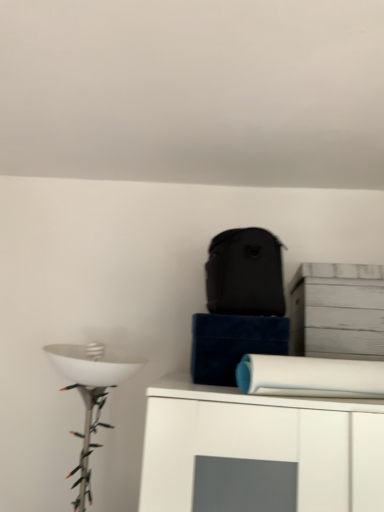
Where is `white wood cabinet at upper right`? Image resolution: width=384 pixels, height=512 pixels. white wood cabinet at upper right is located at coordinates (337, 311).

What do you see at coordinates (337, 311) in the screenshot? I see `white wood cabinet at upper right` at bounding box center [337, 311].

The width and height of the screenshot is (384, 512). What do you see at coordinates (310, 377) in the screenshot? I see `white matte toilet paper at upper right` at bounding box center [310, 377].

The width and height of the screenshot is (384, 512). In order to click on white matte toilet paper at upper right in this screenshot , I will do `click(310, 377)`.

The width and height of the screenshot is (384, 512). I want to click on white wood cabinet at upper right, so click(337, 311).

Is white wood cabinet at upper right to the left or to the right of white matte toilet paper at upper right in the image?

Based on their positions, white wood cabinet at upper right is located to the right of white matte toilet paper at upper right.

Based on the photo, does white wood cabinet at upper right lie in front of white matte toilet paper at upper right?

No, white wood cabinet at upper right is behind white matte toilet paper at upper right.

Is point (351, 279) in front of point (307, 369)?

No.

From the image's perspective, would you say white wood cabinet at upper right is shown under white matte toilet paper at upper right?

Incorrect, from the image's perspective, white wood cabinet at upper right is higher than white matte toilet paper at upper right.

From a real-world perspective, which is physically below, white wood cabinet at upper right or white matte toilet paper at upper right?

In real-world perspective, white matte toilet paper at upper right is lower.

Which of these two, white wood cabinet at upper right or white matte toilet paper at upper right, is wider?

Wider between the two is white matte toilet paper at upper right.

Between white wood cabinet at upper right and white matte toilet paper at upper right, which one has less height?

white matte toilet paper at upper right.

Can you confirm if white wood cabinet at upper right is bigger than white matte toilet paper at upper right?

No, white wood cabinet at upper right is not bigger than white matte toilet paper at upper right.

Would you say white wood cabinet at upper right is inside or outside white matte toilet paper at upper right?

white wood cabinet at upper right is outside white matte toilet paper at upper right.

Would you say white wood cabinet at upper right is a long distance from white matte toilet paper at upper right?

No, white wood cabinet at upper right is in close proximity to white matte toilet paper at upper right.

Is white wood cabinet at upper right facing away from white matte toilet paper at upper right?

white wood cabinet at upper right does not have its back to white matte toilet paper at upper right.

How different are the orientations of white wood cabinet at upper right and white matte toilet paper at upper right in degrees?

The facing directions of white wood cabinet at upper right and white matte toilet paper at upper right are 26.9 degrees apart.

You are a GUI agent. You are given a task and a screenshot of the screen. Output one action in this format:
    pyautogui.click(x=<x>, y=<y>)
    Task: Click on the cabinetry behind the white matte toilet paper at upper right
    The height and width of the screenshot is (512, 384).
    Given the screenshot: What is the action you would take?
    pyautogui.click(x=337, y=311)

Which is more to the left, white matte toilet paper at upper right or white wood cabinet at upper right?

Positioned to the left is white matte toilet paper at upper right.

Is white matte toilet paper at upper right closer to the viewer compared to white wood cabinet at upper right?

Yes.

Does point (365, 368) appear closer or farther from the camera than point (383, 319)?

Point (365, 368).

From the image's perspective, is white matte toilet paper at upper right located above or below white wood cabinet at upper right?

Clearly, from the image's perspective, white matte toilet paper at upper right is below white wood cabinet at upper right.

From a real-world perspective, is white matte toilet paper at upper right located beneath white wood cabinet at upper right?

Yes, from a real-world perspective, white matte toilet paper at upper right is below white wood cabinet at upper right.

Looking at their sizes, would you say white matte toilet paper at upper right is wider or thinner than white wood cabinet at upper right?

In the image, white matte toilet paper at upper right appears to be wider than white wood cabinet at upper right.

Does white matte toilet paper at upper right have a greater height compared to white wood cabinet at upper right?

In fact, white matte toilet paper at upper right may be shorter than white wood cabinet at upper right.

Based on their sizes in the image, would you say white matte toilet paper at upper right is bigger or smaller than white wood cabinet at upper right?

Clearly, white matte toilet paper at upper right is larger in size than white wood cabinet at upper right.

Is white wood cabinet at upper right inside white matte toilet paper at upper right?

No, white wood cabinet at upper right is not surrounded by white matte toilet paper at upper right.

Would you consider white matte toilet paper at upper right to be distant from white wood cabinet at upper right?

No, white matte toilet paper at upper right is not far from white wood cabinet at upper right.

Is white matte toilet paper at upper right aimed at white wood cabinet at upper right?

No.

Looking at this image, how different are the orientations of white matte toilet paper at upper right and white wood cabinet at upper right in degrees?

white matte toilet paper at upper right and white wood cabinet at upper right are facing 26.9 degrees away from each other.

Where is `toilet paper located in front of the white wood cabinet at upper right`? toilet paper located in front of the white wood cabinet at upper right is located at coordinates (310, 377).

You are a GUI agent. You are given a task and a screenshot of the screen. Output one action in this format:
    pyautogui.click(x=<x>, y=<y>)
    Task: Click on the toilet paper lying on the left of white wood cabinet at upper right
    
    Given the screenshot: What is the action you would take?
    pyautogui.click(x=310, y=377)

Identify the location of cabinetry on the right of white matte toilet paper at upper right. Image resolution: width=384 pixels, height=512 pixels. (337, 311).